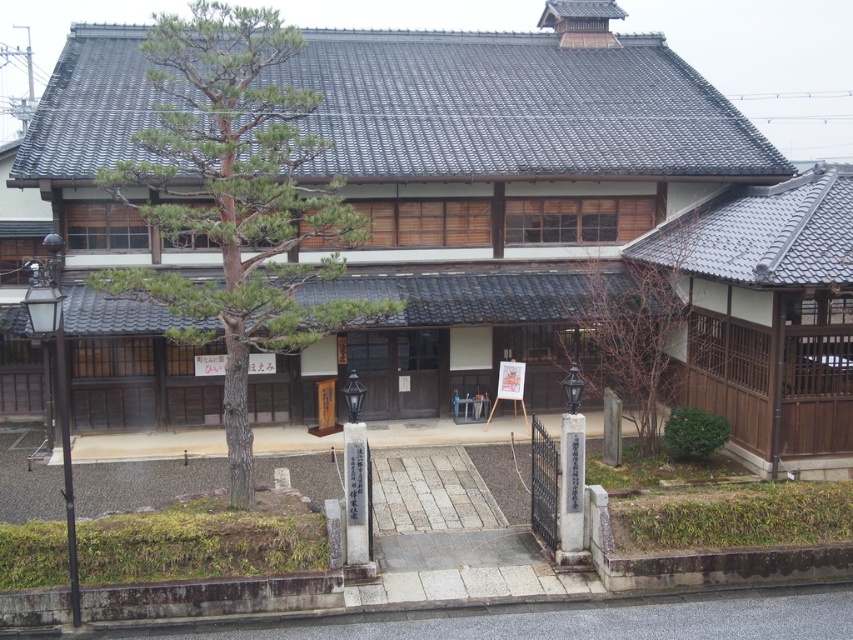
In the scene shown: Which is below, green textured pine tree at center or bare wood tree at center?

Positioned lower is bare wood tree at center.

This screenshot has height=640, width=853. What are the coordinates of `green textured pine tree at center` in the screenshot? It's located at (235, 198).